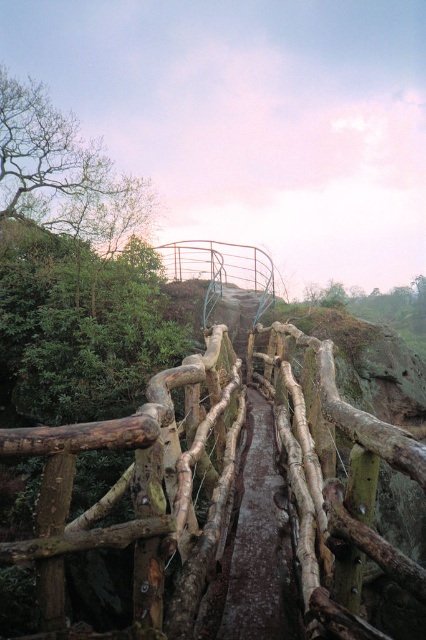
You are standing on the rustic wooden bridge and want to reach the point at coordinates point (60,541). If your walking speed is 1.5 meters per second, how long will it take you to reach that point?

The point at coordinates point (60,541) is 2.29 meters away from the camera. At a walking speed of 1.5 meters per second, it will take approximately 1.5 seconds to reach the point.

You are standing on the rustic wooden bridge and want to know which object is nearer to you between the natural wood fence at center and the brown rough wooden path at center. Which one is closer?

The natural wood fence at center is closer to the viewer than the brown rough wooden path at center, so the natural wood fence at center is closer.